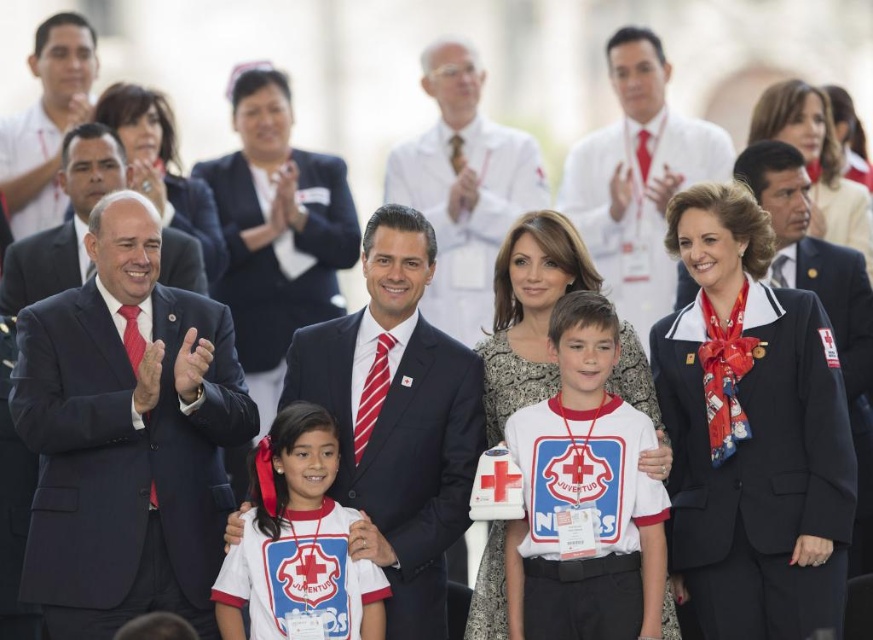
Between point (402, 490) and point (299, 406), which one is positioned behind?

The point (402, 490) is behind.

Locate an element on the screen. matte black suit at center is located at coordinates (397, 420).

Locate an element on the screen. The height and width of the screenshot is (640, 873). matte black suit at center is located at coordinates (397, 420).

Consider the image. Who is positioned more to the left, matte black suit at center or white cotton shirt at center?

matte black suit at center is more to the left.

Between point (438, 365) and point (572, 570), which one is positioned behind?

The point (438, 365) is behind.

This screenshot has height=640, width=873. I want to click on matte black suit at center, so click(x=397, y=420).

Who is lower down, matte black suit at left or white jersey at center?

white jersey at center is below.

Is matte black suit at left shorter than white jersey at center?

No.

Is point (227, 436) positioned behind point (300, 483)?

Yes, it is behind point (300, 483).

The height and width of the screenshot is (640, 873). Identify the location of matte black suit at left. (126, 435).